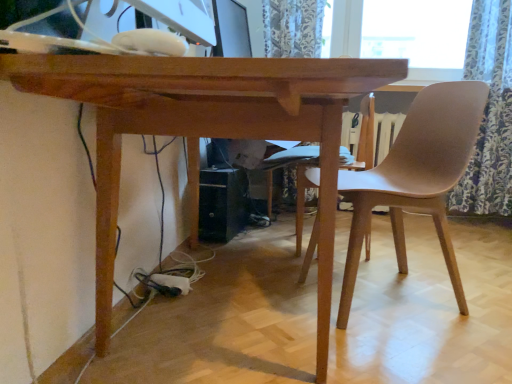
Question: Is floral fabric curtain at right surrounding matte black monitor at upper center?

Choices:
 (A) yes
 (B) no

Answer: (B)

Question: Can you confirm if floral fabric curtain at right is thinner than matte black monitor at upper center?

Choices:
 (A) yes
 (B) no

Answer: (B)

Question: Is the depth of floral fabric curtain at right less than that of matte black monitor at upper center?

Choices:
 (A) no
 (B) yes

Answer: (A)

Question: Is the depth of floral fabric curtain at right greater than that of matte black monitor at upper center?

Choices:
 (A) no
 (B) yes

Answer: (B)

Question: Is floral fabric curtain at right at the left side of matte black monitor at upper center?

Choices:
 (A) no
 (B) yes

Answer: (A)

Question: From their relative heights in the image, would you say wooden table at center is taller or shorter than matte black monitor at upper center?

Choices:
 (A) short
 (B) tall

Answer: (B)

Question: Is wooden table at center in front of or behind matte black monitor at upper center in the image?

Choices:
 (A) behind
 (B) front

Answer: (B)

Question: From a real-world perspective, is wooden table at center physically located above or below matte black monitor at upper center?

Choices:
 (A) below
 (B) above

Answer: (A)

Question: Is wooden table at center situated inside matte black monitor at upper center or outside?

Choices:
 (A) inside
 (B) outside

Answer: (B)

Question: From their relative heights in the image, would you say matte brown chair at right is taller or shorter than matte black monitor at upper center?

Choices:
 (A) short
 (B) tall

Answer: (B)

Question: From a real-world perspective, is matte brown chair at right positioned above or below matte black monitor at upper center?

Choices:
 (A) below
 (B) above

Answer: (A)

Question: From the image's perspective, is matte brown chair at right above or below matte black monitor at upper center?

Choices:
 (A) below
 (B) above

Answer: (A)

Question: Which is correct: matte brown chair at right is inside matte black monitor at upper center, or outside of it?

Choices:
 (A) outside
 (B) inside

Answer: (A)

Question: From a real-world perspective, is floral fabric curtain at right positioned above or below matte brown chair at right?

Choices:
 (A) below
 (B) above

Answer: (B)

Question: Is floral fabric curtain at right inside or outside of matte brown chair at right?

Choices:
 (A) outside
 (B) inside

Answer: (A)